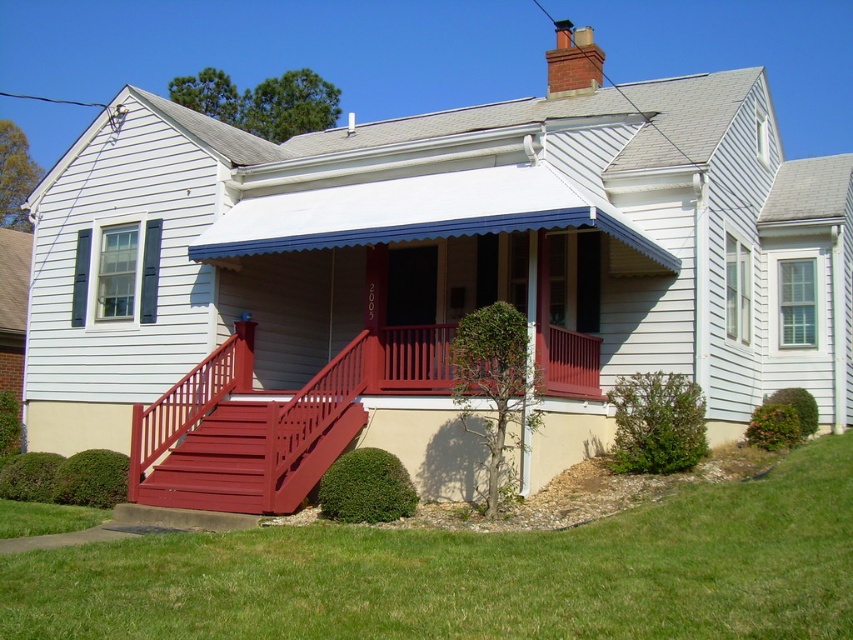
Which is more to the right, green grass at lower center or smooth wood stairs at center?

From the viewer's perspective, green grass at lower center appears more on the right side.

Which is in front, point (775, 474) or point (332, 461)?

Point (775, 474) is in front.

I want to click on green grass at lower center, so click(477, 573).

Which is in front, point (421, 636) or point (239, 483)?

Point (421, 636) is more forward.

Does green grass at lower center have a lesser width compared to smooth red wooden porch at center?

No, green grass at lower center is not thinner than smooth red wooden porch at center.

At what (x,y) coordinates should I click in order to perform the action: click on green grass at lower center. Please return your answer as a coordinate pair (x, y). The image size is (853, 640). Looking at the image, I should click on (477, 573).

Locate an element on the screen. The width and height of the screenshot is (853, 640). smooth red wooden porch at center is located at coordinates (271, 420).

Does point (357, 401) lie in front of point (265, 419)?

No, it is behind (265, 419).

Which is in front, point (387, 381) or point (212, 419)?

Point (387, 381) is more forward.

I want to click on smooth red wooden porch at center, so click(x=271, y=420).